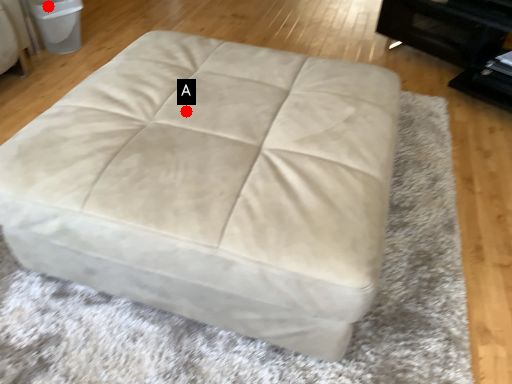
Question: Two points are circled on the image, labeled by A and B beside each circle. Among these points, which one is farthest from the camera?

Choices:
 (A) A is further
 (B) B is further

Answer: (B)